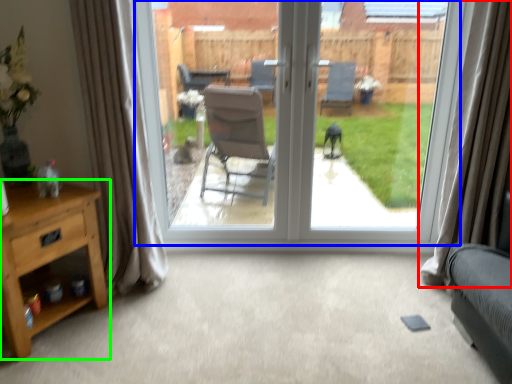
Question: Which object is positioned closest to curtain (highlighted by a red box)? Select from window (highlighted by a blue box) and nightstand (highlighted by a green box).

Choices:
 (A) window
 (B) nightstand

Answer: (A)